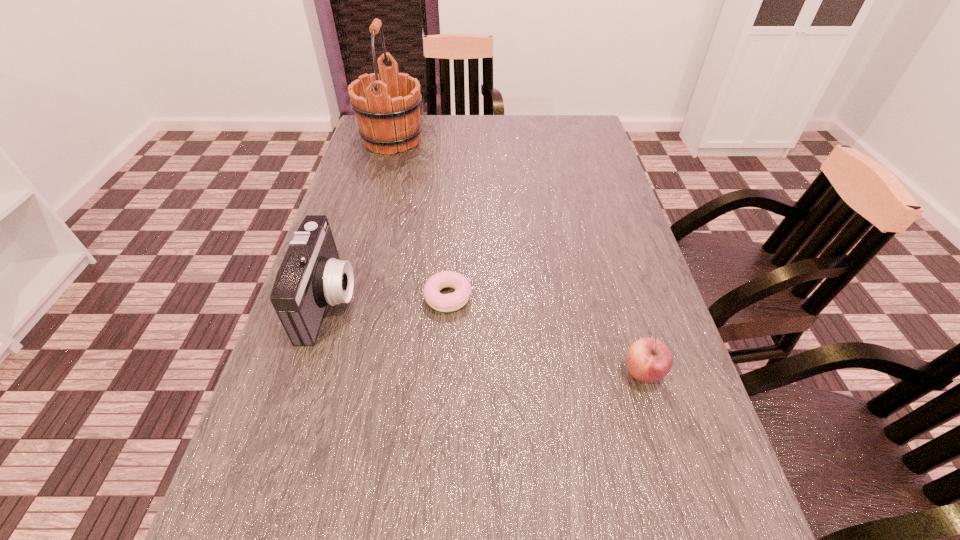
You are a GUI agent. You are given a task and a screenshot of the screen. Output one action in this format:
    pyautogui.click(x=<x>, y=<y>)
    Task: Click on the free space between the wine bucket and the shortest object
    The image size is (960, 540).
    Given the screenshot: What is the action you would take?
    pyautogui.click(x=420, y=219)

Find the location of `object that is the second closest one to the camcorder`. object that is the second closest one to the camcorder is located at coordinates (387, 104).

Locate an element on the screen. This screenshot has height=540, width=960. object that ranks as the second closest to the second shortest object is located at coordinates (311, 276).

At what (x,y) coordinates should I click in order to perform the action: click on vacant space that satisfies the following two spatial constraints: 1. on the front side of the wine bucket; 2. on the left side of the second object from right to left. Please return your answer as a coordinate pair (x, y). Image resolution: width=960 pixels, height=540 pixels. Looking at the image, I should click on (349, 298).

The image size is (960, 540). Find the location of `free spot that satisfies the following two spatial constraints: 1. on the lens of the apple; 2. on the left side of the camcorder`. free spot that satisfies the following two spatial constraints: 1. on the lens of the apple; 2. on the left side of the camcorder is located at coordinates (306, 373).

Identify the location of free location that satisfies the following two spatial constraints: 1. on the front side of the nearest object; 2. on the right side of the third object from left to right. Image resolution: width=960 pixels, height=540 pixels. (444, 373).

Identify the location of vacant space that satisfies the following two spatial constraints: 1. on the front side of the tallest object; 2. on the right side of the nearest object. (329, 373).

This screenshot has width=960, height=540. In order to click on vacant space that satisfies the following two spatial constraints: 1. on the back side of the second shortest object; 2. on the lens of the camcorder in this screenshot , I will do `click(622, 300)`.